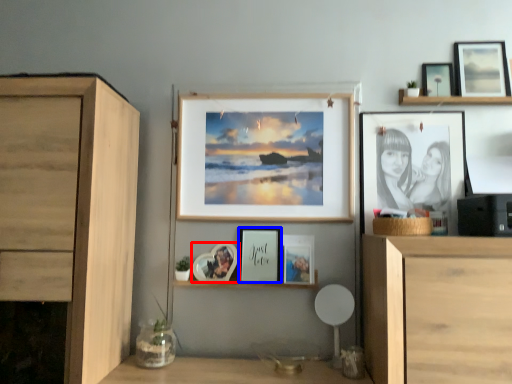
Question: Which object appears closest to the camera in this image, picture frame (highlighted by a red box) or picture frame (highlighted by a blue box)?

Choices:
 (A) picture frame
 (B) picture frame

Answer: (A)